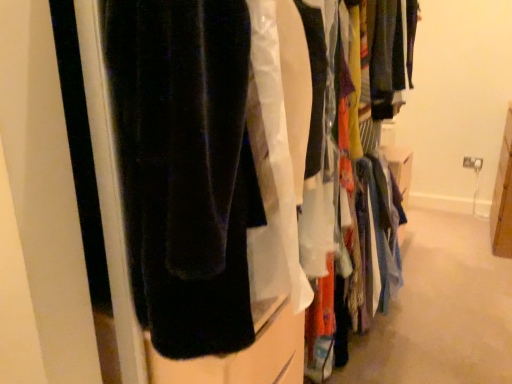
Question: Is point (318, 148) positioned closer to the camera than point (256, 294)?

Choices:
 (A) closer
 (B) farther

Answer: (B)

Question: Is light blue fabric at center, acting as the first closet starting from the right, taller or shorter than velvet black pants at left, which is counted as the first closet, starting from the left?

Choices:
 (A) short
 (B) tall

Answer: (A)

Question: Is light blue fabric at center, acting as the first closet starting from the right, bigger or smaller than velvet black pants at left, marked as the second closet in a right-to-left arrangement?

Choices:
 (A) big
 (B) small

Answer: (B)

Question: Is velvet black pants at left, marked as the second closet in a right-to-left arrangement, to the left or to the right of light blue fabric at center, acting as the first closet starting from the right, in the image?

Choices:
 (A) left
 (B) right

Answer: (A)

Question: Which is correct: velvet black pants at left, marked as the second closet in a right-to-left arrangement, is inside light blue fabric at center, which is the 2th closet from left to right, or outside of it?

Choices:
 (A) inside
 (B) outside

Answer: (B)

Question: From the image's perspective, is velvet black pants at left, which is counted as the first closet, starting from the left, positioned above or below light blue fabric at center, acting as the first closet starting from the right?

Choices:
 (A) below
 (B) above

Answer: (B)

Question: From a real-world perspective, is velvet black pants at left, which is counted as the first closet, starting from the left, physically located above or below light blue fabric at center, which is the 2th closet from left to right?

Choices:
 (A) below
 (B) above

Answer: (B)